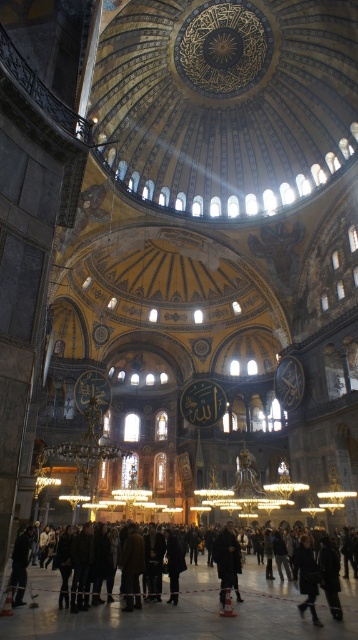
Question: Which point is closer to the camera?

Choices:
 (A) (355, 627)
 (B) (302, 538)

Answer: (A)

Question: Is dark brown coat at lower center wider than brown leather coat at center?

Choices:
 (A) yes
 (B) no

Answer: (A)

Question: Which of the following is the closest to the observer?

Choices:
 (A) brown leather coat at center
 (B) dark wool coat at center
 (C) dark brown leather coat at lower right
 (D) dark brown coat at lower center

Answer: (D)

Question: Which point is closer to the camera taking this photo?

Choices:
 (A) (313, 563)
 (B) (129, 596)
 (C) (219, 561)
 (D) (22, 532)

Answer: (B)

Question: Is dark brown coat at lower center further to camera compared to dark wool coat at center?

Choices:
 (A) no
 (B) yes

Answer: (A)

Question: Is dark wool coat at center smaller than dark brown leather coat at lower right?

Choices:
 (A) no
 (B) yes

Answer: (A)